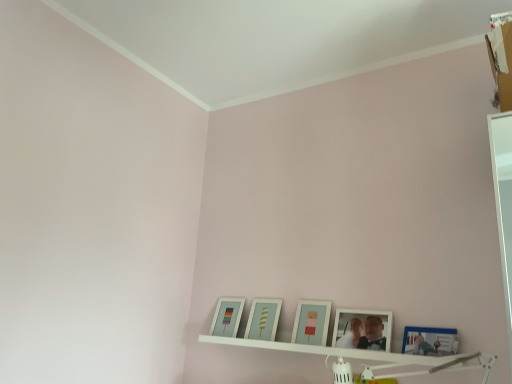
Question: Is white matte picture frame at lower center, positioned as the fourth picture frame in left-to-right order, not within matte white picture frame at center, which is the second picture frame from left to right?

Choices:
 (A) yes
 (B) no

Answer: (A)

Question: Does white matte picture frame at lower center, placed as the second picture frame when sorted from right to left, lie behind matte white picture frame at center, placed as the fourth picture frame when sorted from right to left?

Choices:
 (A) no
 (B) yes

Answer: (A)

Question: Is white matte picture frame at lower center, positioned as the fourth picture frame in left-to-right order, far away from matte white picture frame at center, which is the second picture frame from left to right?

Choices:
 (A) yes
 (B) no

Answer: (B)

Question: Is white matte picture frame at lower center, placed as the second picture frame when sorted from right to left, facing towards matte white picture frame at center, placed as the fourth picture frame when sorted from right to left?

Choices:
 (A) no
 (B) yes

Answer: (A)

Question: From the image's perspective, is white matte picture frame at lower center, placed as the second picture frame when sorted from right to left, beneath matte white picture frame at center, which is the second picture frame from left to right?

Choices:
 (A) yes
 (B) no

Answer: (B)

Question: In terms of size, does matte white picture frame at center, which is the second picture frame from left to right, appear bigger or smaller than matte glass picture frame at lower left, the 1th picture frame in the left-to-right sequence?

Choices:
 (A) big
 (B) small

Answer: (B)

Question: From a real-world perspective, relative to matte glass picture frame at lower left, which is counted as the 5th picture frame, starting from the right, is matte white picture frame at center, which is the second picture frame from left to right, vertically above or below?

Choices:
 (A) above
 (B) below

Answer: (B)

Question: Is matte white picture frame at center, placed as the fourth picture frame when sorted from right to left, taller or shorter than matte glass picture frame at lower left, the 1th picture frame in the left-to-right sequence?

Choices:
 (A) short
 (B) tall

Answer: (A)

Question: From the image's perspective, is matte white picture frame at center, which is the second picture frame from left to right, located above or below matte glass picture frame at lower left, the 1th picture frame in the left-to-right sequence?

Choices:
 (A) above
 (B) below

Answer: (A)

Question: Is blue glossy picture frame at lower right, which ranks as the 5th picture frame in left-to-right order, situated inside matte white picture frame at center, placed as the fourth picture frame when sorted from right to left, or outside?

Choices:
 (A) inside
 (B) outside

Answer: (B)

Question: Considering the positions of blue glossy picture frame at lower right, which is the 1th picture frame in right-to-left order, and matte white picture frame at center, placed as the fourth picture frame when sorted from right to left, in the image, is blue glossy picture frame at lower right, which is the 1th picture frame in right-to-left order, wider or thinner than matte white picture frame at center, placed as the fourth picture frame when sorted from right to left,?

Choices:
 (A) thin
 (B) wide

Answer: (B)

Question: From a real-world perspective, is blue glossy picture frame at lower right, which ranks as the 5th picture frame in left-to-right order, above or below matte white picture frame at center, which is the second picture frame from left to right?

Choices:
 (A) below
 (B) above

Answer: (A)

Question: From the image's perspective, is blue glossy picture frame at lower right, which ranks as the 5th picture frame in left-to-right order, above or below matte white picture frame at center, placed as the fourth picture frame when sorted from right to left?

Choices:
 (A) below
 (B) above

Answer: (B)

Question: Is matte glass picture frame at lower left, the 1th picture frame in the left-to-right sequence, situated inside blue glossy picture frame at lower right, which is the 1th picture frame in right-to-left order, or outside?

Choices:
 (A) outside
 (B) inside

Answer: (A)

Question: From the image's perspective, relative to blue glossy picture frame at lower right, which ranks as the 5th picture frame in left-to-right order, is matte glass picture frame at lower left, the 1th picture frame in the left-to-right sequence, above or below?

Choices:
 (A) above
 (B) below

Answer: (B)